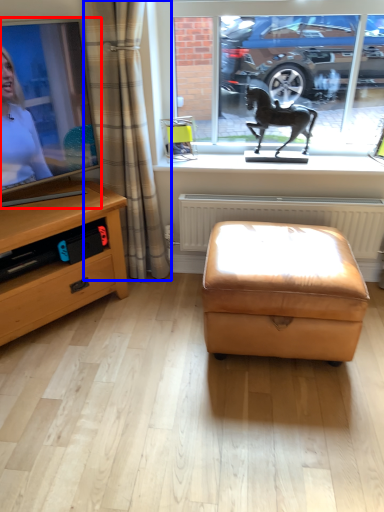
Question: Which object appears farthest to the camera in this image, television (highlighted by a red box) or curtain (highlighted by a blue box)?

Choices:
 (A) television
 (B) curtain

Answer: (B)